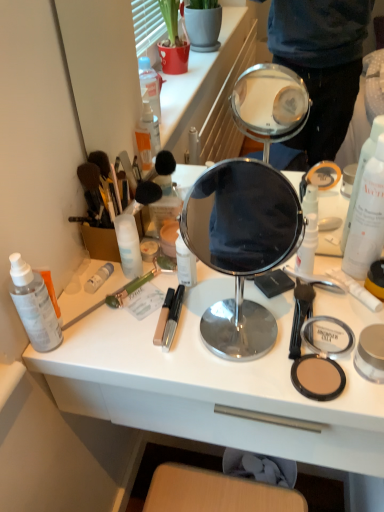
The height and width of the screenshot is (512, 384). In order to click on vacant space that is in between polished silver mirror at center and white matte pump bottle at right, which ranks as the 2th toiletry in right-to-left order in this screenshot , I will do `click(263, 293)`.